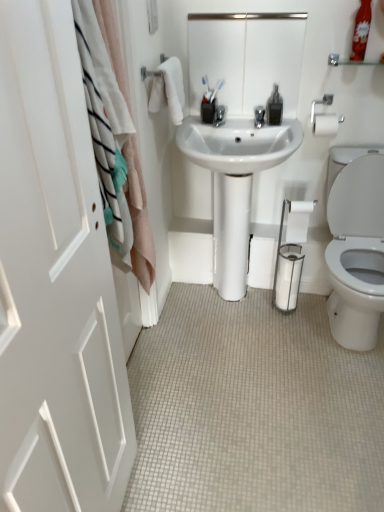
Question: Can you confirm if white paper roll at lower right is shorter than white tile floor at lower center?

Choices:
 (A) no
 (B) yes

Answer: (A)

Question: Does white paper roll at lower right have a smaller size compared to white tile floor at lower center?

Choices:
 (A) yes
 (B) no

Answer: (A)

Question: Can you confirm if white paper roll at lower right is taller than white tile floor at lower center?

Choices:
 (A) no
 (B) yes

Answer: (B)

Question: Can you confirm if white paper roll at lower right is thinner than white tile floor at lower center?

Choices:
 (A) no
 (B) yes

Answer: (B)

Question: From the image's perspective, does white paper roll at lower right appear higher than white tile floor at lower center?

Choices:
 (A) no
 (B) yes

Answer: (B)

Question: Is white paper roll at lower right bigger than white tile floor at lower center?

Choices:
 (A) no
 (B) yes

Answer: (A)

Question: Is clear glass shelf at upper right at the back of white soft towel at upper left?

Choices:
 (A) no
 (B) yes

Answer: (A)

Question: Is white soft towel at upper left with clear glass shelf at upper right?

Choices:
 (A) yes
 (B) no

Answer: (B)

Question: Is white soft towel at upper left at the right side of clear glass shelf at upper right?

Choices:
 (A) no
 (B) yes

Answer: (A)

Question: Is white soft towel at upper left completely or partially outside of clear glass shelf at upper right?

Choices:
 (A) no
 (B) yes

Answer: (B)

Question: Does white soft towel at upper left come behind clear glass shelf at upper right?

Choices:
 (A) yes
 (B) no

Answer: (B)

Question: Does white soft towel at upper left contain clear glass shelf at upper right?

Choices:
 (A) yes
 (B) no

Answer: (B)

Question: Is white glossy mirror at upper center not within white matte door at left?

Choices:
 (A) no
 (B) yes

Answer: (B)